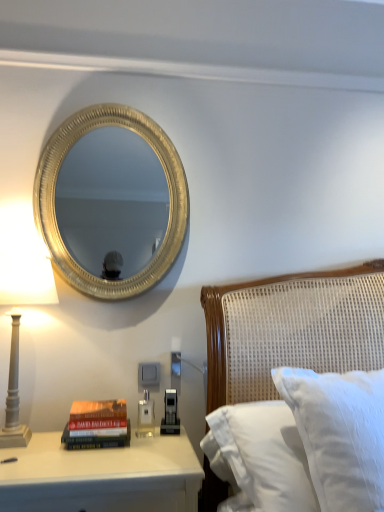
Question: Is the surface of hardcover book at lower left in direct contact with white glossy nightstand at lower left?

Choices:
 (A) no
 (B) yes

Answer: (A)

Question: Considering the relative sizes of hardcover book at lower left and white glossy nightstand at lower left in the image provided, is hardcover book at lower left bigger than white glossy nightstand at lower left?

Choices:
 (A) no
 (B) yes

Answer: (A)

Question: Is hardcover book at lower left closer to the viewer compared to white glossy nightstand at lower left?

Choices:
 (A) no
 (B) yes

Answer: (A)

Question: From the image's perspective, would you say hardcover book at lower left is positioned over white glossy nightstand at lower left?

Choices:
 (A) no
 (B) yes

Answer: (B)

Question: Is hardcover book at lower left far from white glossy nightstand at lower left?

Choices:
 (A) no
 (B) yes

Answer: (A)

Question: Is the position of hardcover book at lower left more distant than that of white glossy nightstand at lower left?

Choices:
 (A) yes
 (B) no

Answer: (A)

Question: Is white textured pillow at right in contact with hardcover book at lower left?

Choices:
 (A) yes
 (B) no

Answer: (B)

Question: Is white textured pillow at right to the right of hardcover book at lower left from the viewer's perspective?

Choices:
 (A) yes
 (B) no

Answer: (A)

Question: Is white textured pillow at right behind hardcover book at lower left?

Choices:
 (A) no
 (B) yes

Answer: (A)

Question: Is white textured pillow at right facing away from hardcover book at lower left?

Choices:
 (A) yes
 (B) no

Answer: (B)

Question: Is white textured pillow at right positioned beyond the bounds of hardcover book at lower left?

Choices:
 (A) no
 (B) yes

Answer: (B)

Question: From the image's perspective, is white textured pillow at right under hardcover book at lower left?

Choices:
 (A) yes
 (B) no

Answer: (B)

Question: From a real-world perspective, is white textured pillow at right under gold textured mirror at upper left?

Choices:
 (A) no
 (B) yes

Answer: (B)